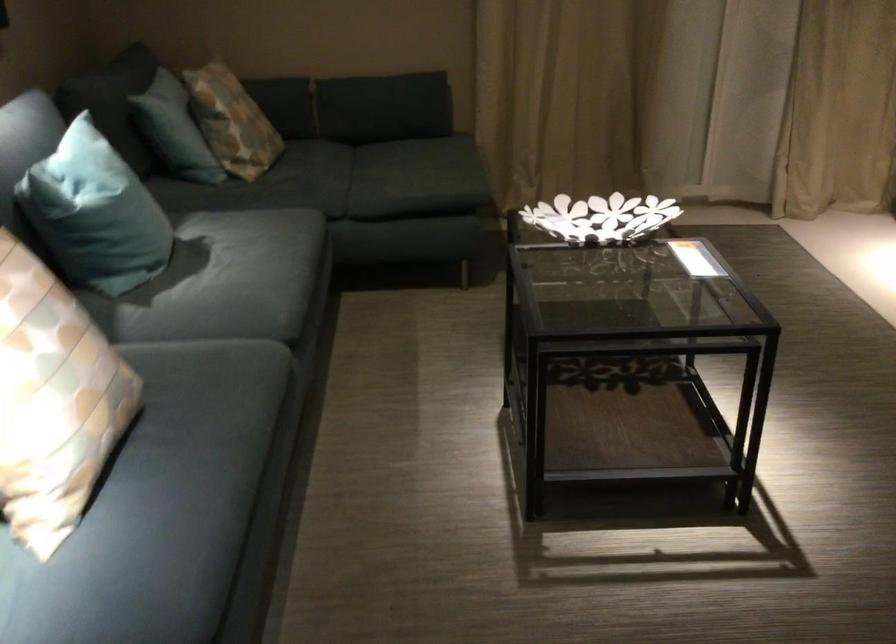
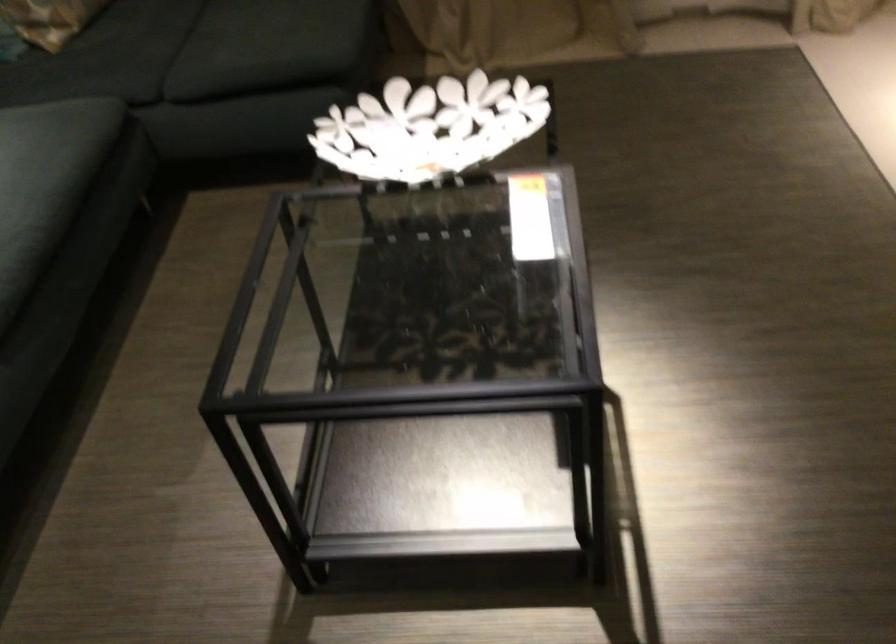
Question: The first image is from the beginning of the video and the second image is from the end. How did the camera likely rotate when shooting the video?

Choices:
 (A) Left
 (B) Right
 (C) Up
 (D) Down

Answer: (D)